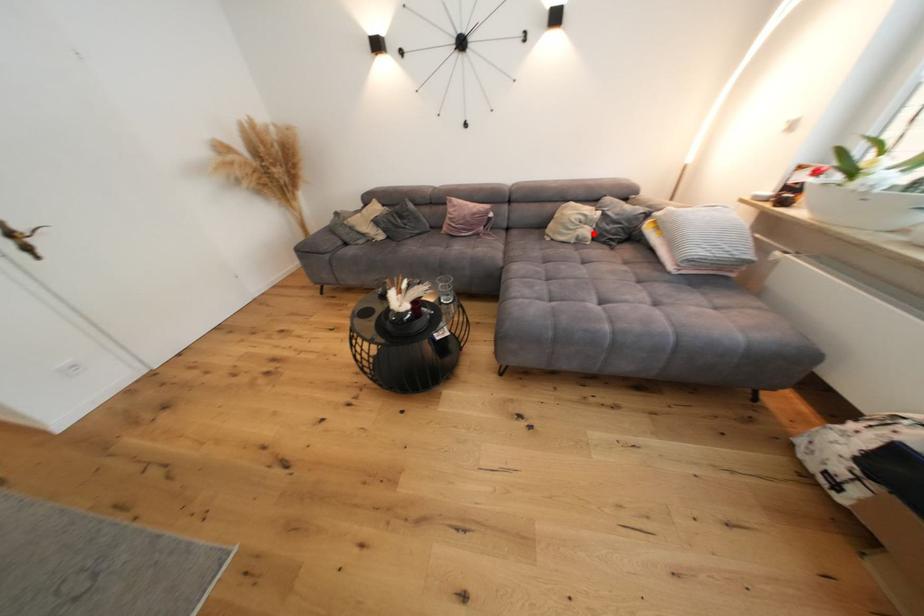
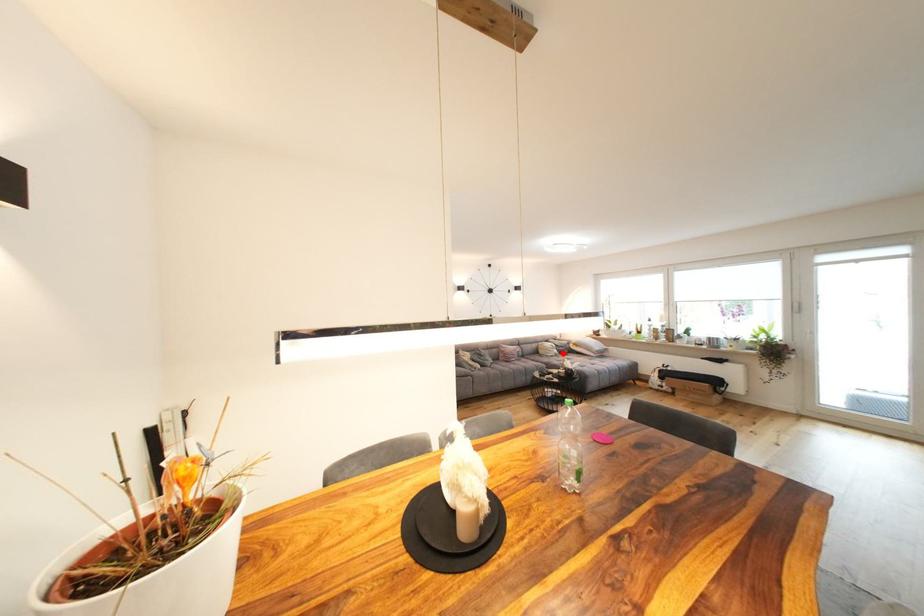
I am providing you with two images of the same scene from different viewpoints. A red point is marked on the first image and another point is marked on the second image. Is the marked point in image1 the same physical position as the marked point in image2?

Yes